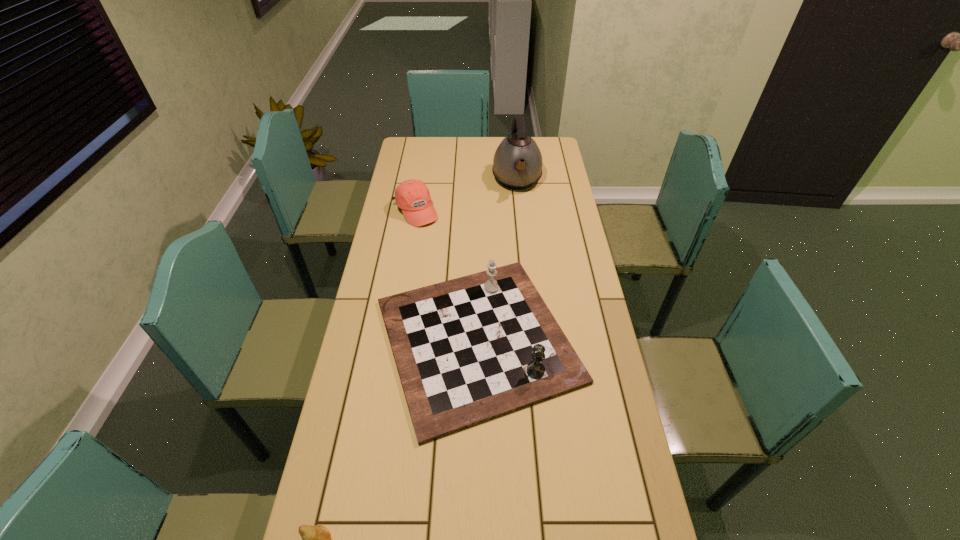
Locate an element on the screen. The height and width of the screenshot is (540, 960). kettle that is at the right edge is located at coordinates (517, 164).

You are a GUI agent. You are given a task and a screenshot of the screen. Output one action in this format:
    pyautogui.click(x=<x>, y=<y>)
    Task: Click on the gameboard that is at the right edge
    
    Given the screenshot: What is the action you would take?
    pyautogui.click(x=467, y=350)

The width and height of the screenshot is (960, 540). In order to click on object present at the far right corner in this screenshot , I will do `click(517, 164)`.

This screenshot has height=540, width=960. In the image, there is a desktop. In order to click on free space at the far edge in this screenshot , I will do `click(466, 138)`.

Locate an element on the screen. vacant position at the left edge of the desktop is located at coordinates (396, 262).

Find the location of a particular element. Image resolution: width=960 pixels, height=540 pixels. vacant space at the right edge is located at coordinates (614, 445).

Where is `vacant area that lies between the baseball cap and the kettle`? The width and height of the screenshot is (960, 540). vacant area that lies between the baseball cap and the kettle is located at coordinates (466, 195).

The height and width of the screenshot is (540, 960). Find the location of `vacant area between the second tallest object and the kettle`. vacant area between the second tallest object and the kettle is located at coordinates (497, 260).

Find the location of a particular element. empty space that is in between the second nearest object and the baseball cap is located at coordinates (446, 275).

I want to click on free area in between the kettle and the third shortest object, so click(x=497, y=260).